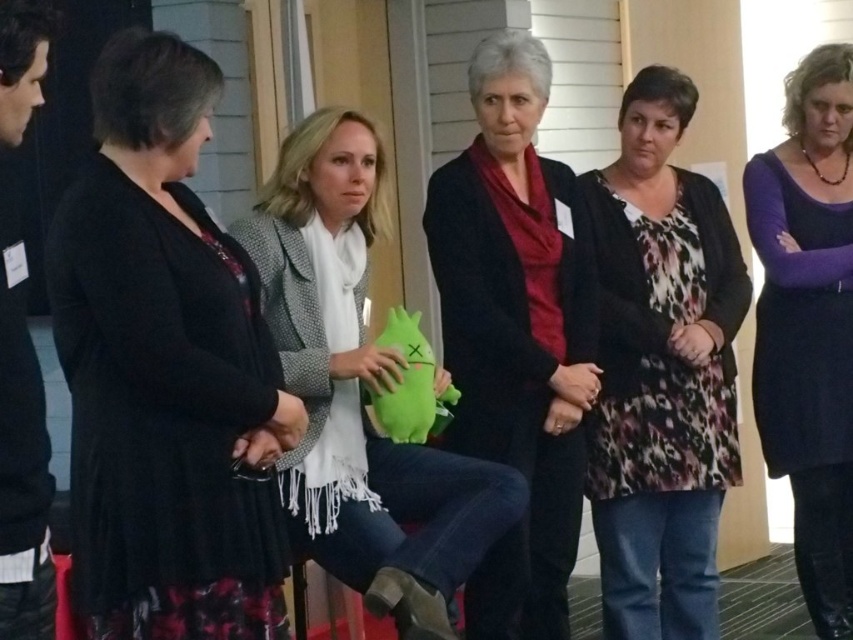
Question: Is floral print sweater at center bigger than matte black jacket at center?

Choices:
 (A) no
 (B) yes

Answer: (B)

Question: Can you confirm if black matte skirt at left is positioned below matte black jacket at center?

Choices:
 (A) yes
 (B) no

Answer: (B)

Question: Which object is positioned farthest from the matte black jacket at center?

Choices:
 (A) green plush toy at center
 (B) floral print sweater at center
 (C) black matte skirt at left
 (D) purple matte dress at center

Answer: (D)

Question: Is floral print sweater at center thinner than purple matte dress at center?

Choices:
 (A) no
 (B) yes

Answer: (A)

Question: Estimate the real-world distances between objects in this image. Which object is farther from the purple matte dress at center?

Choices:
 (A) matte black jacket at center
 (B) green plush toy at center
 (C) floral print sweater at center

Answer: (B)

Question: Which object appears farthest from the camera in this image?

Choices:
 (A) floral print sweater at center
 (B) purple matte dress at center
 (C) matte black jacket at center

Answer: (B)